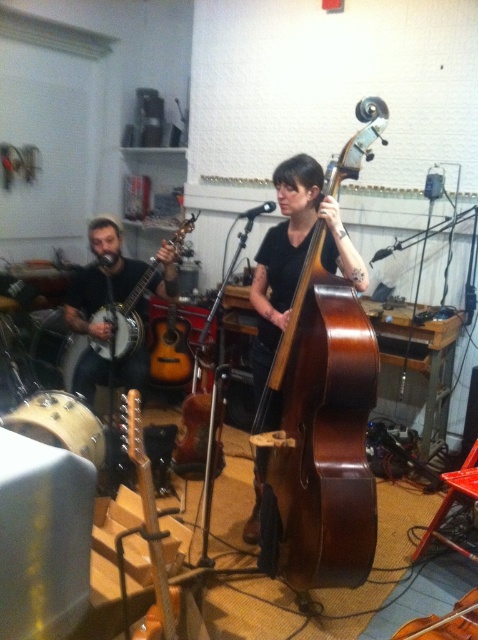
Which is below, brown polished wood cello at center or matte black banjo at left?

brown polished wood cello at center

Does brown polished wood cello at center have a greater width compared to matte black banjo at left?

No, brown polished wood cello at center is not wider than matte black banjo at left.

What do you see at coordinates (318, 436) in the screenshot? I see `brown polished wood cello at center` at bounding box center [318, 436].

I want to click on brown polished wood cello at center, so click(318, 436).

Is matte black banjo at left bigger than brown wooden cello at center?

Yes, matte black banjo at left is bigger than brown wooden cello at center.

At what (x,y) coordinates should I click in order to perform the action: click on matte black banjo at left. Please return your answer as a coordinate pair (x, y). This screenshot has width=478, height=640. Looking at the image, I should click on (101, 280).

Is point (346, 308) farther from camera compared to point (470, 628)?

Yes.

Image resolution: width=478 pixels, height=640 pixels. What do you see at coordinates (318, 436) in the screenshot? I see `brown polished wood cello at center` at bounding box center [318, 436].

The width and height of the screenshot is (478, 640). Describe the element at coordinates (318, 436) in the screenshot. I see `brown polished wood cello at center` at that location.

What are the coordinates of `brown polished wood cello at center` in the screenshot? It's located at (318, 436).